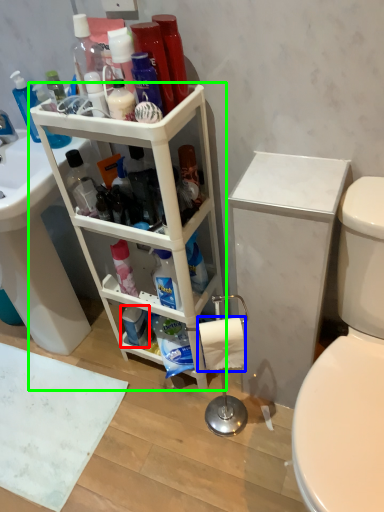
Question: Estimate the real-world distances between objects in this image. Which object is closer to toiletry (highlighted by a red box), toilet paper (highlighted by a blue box) or shelf (highlighted by a green box)?

Choices:
 (A) toilet paper
 (B) shelf

Answer: (B)